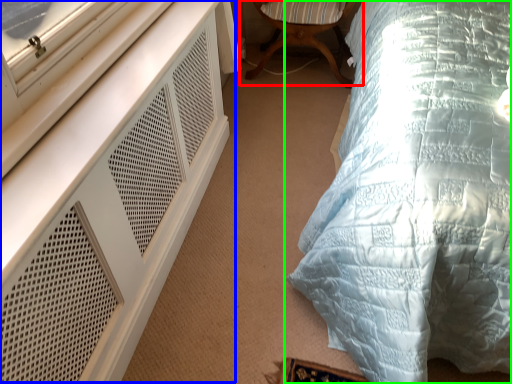
Question: Considering the real-world distances, which object is farthest from chair (highlighted by a red box)? dresser (highlighted by a blue box) or bed (highlighted by a green box)?

Choices:
 (A) dresser
 (B) bed

Answer: (A)